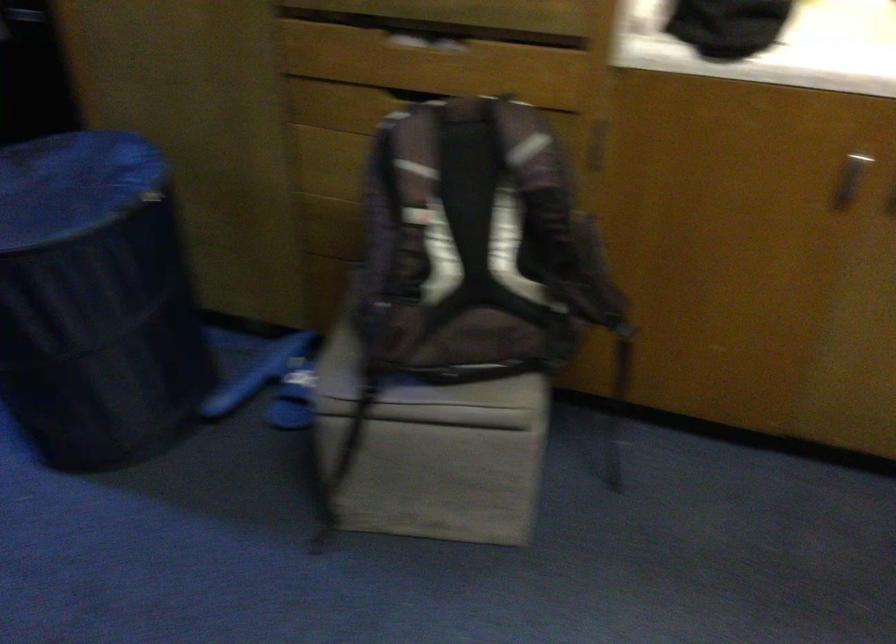
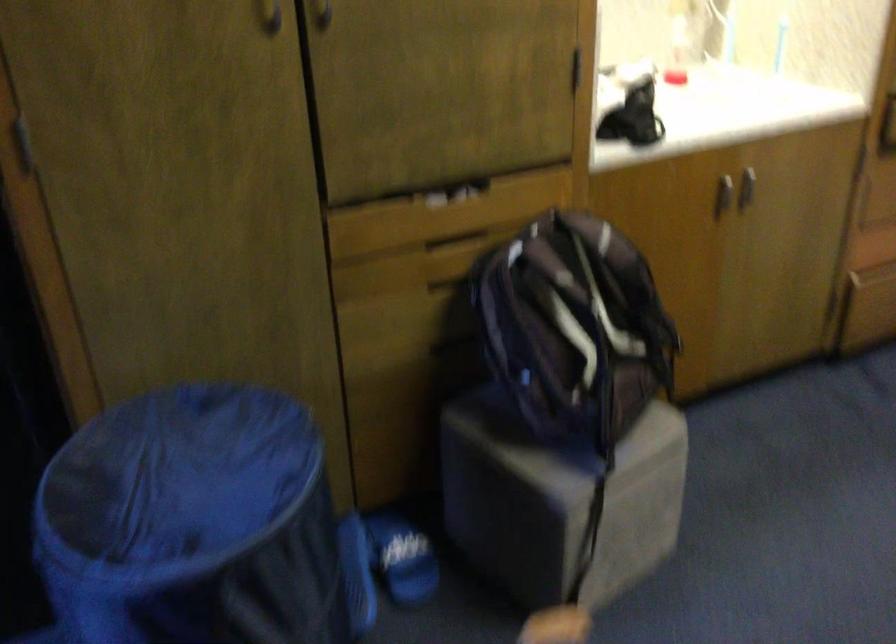
Where in the second image is the point corresponding to point 390,350 from the first image?

(556, 442)